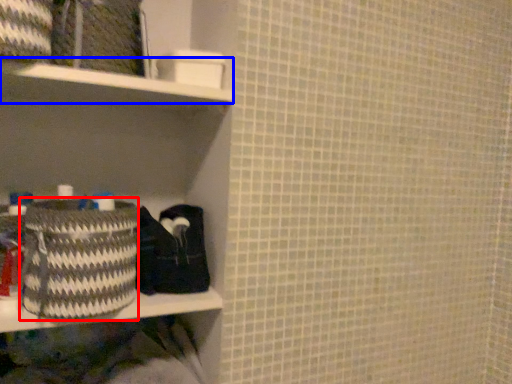
Question: Which of the following is the closest to the observer, basket (highlighted by a red box) or cabinet (highlighted by a blue box)?

Choices:
 (A) basket
 (B) cabinet

Answer: (A)